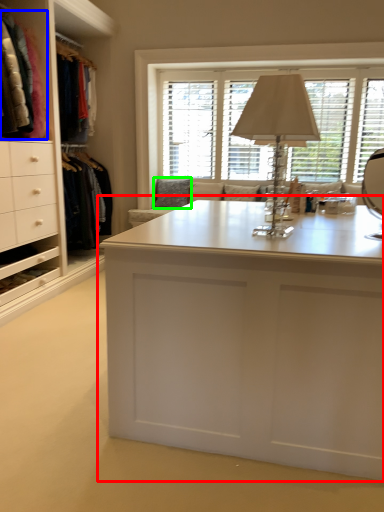
Question: Estimate the real-world distances between objects in this image. Which object is farther from desk (highlighted by a red box), clothing (highlighted by a blue box) or pillow (highlighted by a green box)?

Choices:
 (A) clothing
 (B) pillow

Answer: (B)